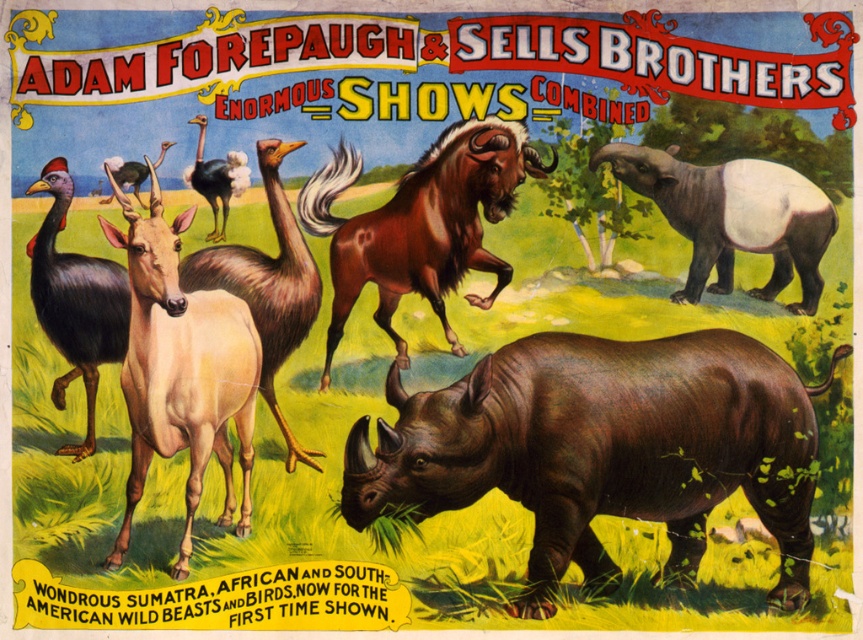
Is light brown glossy antelope at center taller than black feathered bird at left?

Correct, light brown glossy antelope at center is much taller as black feathered bird at left.

Which is more to the right, light brown glossy antelope at center or black feathered bird at left?

light brown glossy antelope at center is more to the right.

Find the location of a particular element. light brown glossy antelope at center is located at coordinates (181, 369).

Which is above, light brown fur goat at center-left or black feathered bird at left?

Positioned higher is black feathered bird at left.

In order to click on light brown fur goat at center-left in this screenshot , I will do `click(268, 285)`.

Where is `light brown fur goat at center-left`? light brown fur goat at center-left is located at coordinates (268, 285).

Is point (121, 541) positioned after point (493, 205)?

That is False.

In the scene shown: Can you confirm if light brown glossy antelope at center is positioned above brown shaggy horse at center?

No, light brown glossy antelope at center is not above brown shaggy horse at center.

Is point (225, 522) closer to viewer compared to point (411, 246)?

Yes, it is in front of point (411, 246).

Find the location of a particular element. light brown glossy antelope at center is located at coordinates (181, 369).